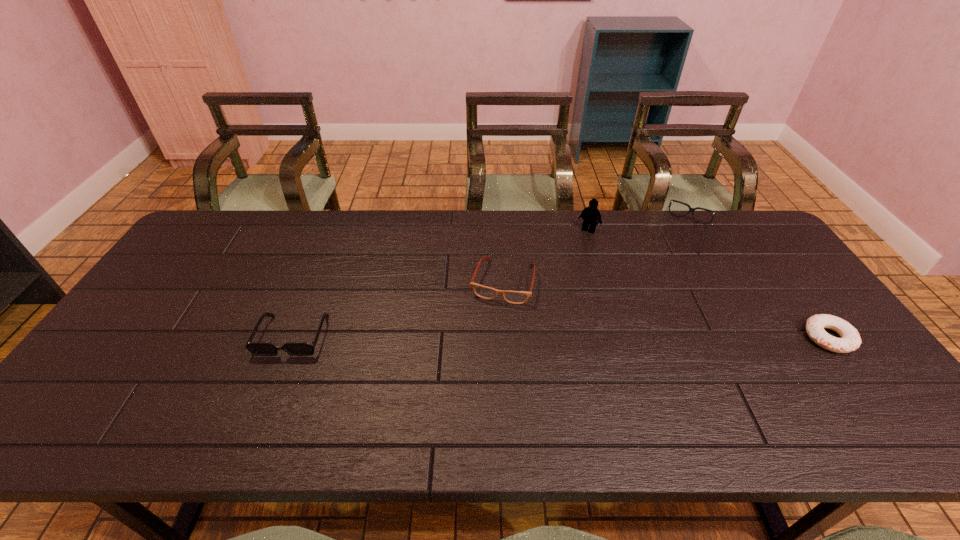
Locate an element on the screen. free region located on the back of the shortest object is located at coordinates (759, 244).

Where is `vacant space situated 0.080m on the front-facing side of the third nearest object`? vacant space situated 0.080m on the front-facing side of the third nearest object is located at coordinates (490, 327).

You are a GUI agent. You are given a task and a screenshot of the screen. Output one action in this format:
    pyautogui.click(x=<x>, y=<y>)
    Task: Click on the blank space located 0.100m on the front-facing side of the third nearest object
    This screenshot has width=960, height=540.
    Given the screenshot: What is the action you would take?
    pyautogui.click(x=489, y=332)

The image size is (960, 540). I want to click on vacant point located 0.300m on the front-facing side of the third nearest object, so click(x=469, y=397).

Locate an element on the screen. The width and height of the screenshot is (960, 540). vacant space situated 0.380m on the face of the tallest object is located at coordinates (538, 306).

I want to click on free space located on the face of the tallest object, so click(x=567, y=260).

Find the location of a particular element. The width and height of the screenshot is (960, 540). free space located on the face of the tallest object is located at coordinates (549, 289).

Where is `free space located with the lenses facing outward on the right spectacles`? free space located with the lenses facing outward on the right spectacles is located at coordinates tap(649, 311).

Find the location of `blank area located 0.240m with the lenses facing outward on the right spectacles`. blank area located 0.240m with the lenses facing outward on the right spectacles is located at coordinates (655, 298).

Locate an element on the screen. free space located with the lenses facing outward on the right spectacles is located at coordinates (663, 277).